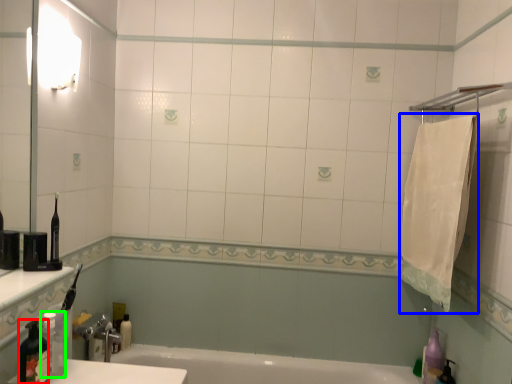
Question: Considering the real-world distances, which object is farthest from bottle (highlighted by a red box)? bath towel (highlighted by a blue box) or bottle (highlighted by a green box)?

Choices:
 (A) bath towel
 (B) bottle

Answer: (A)